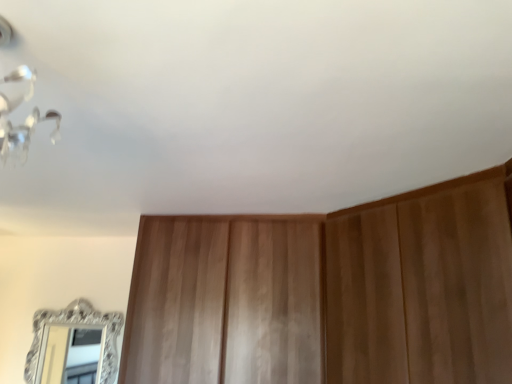
Question: Is wooden dresser at center not within silver ornate mirror at lower left?

Choices:
 (A) no
 (B) yes

Answer: (B)

Question: From a real-world perspective, is wooden dresser at center located beneath silver ornate mirror at lower left?

Choices:
 (A) yes
 (B) no

Answer: (B)

Question: Is wooden dresser at center thinner than silver ornate mirror at lower left?

Choices:
 (A) yes
 (B) no

Answer: (B)

Question: Considering the relative sizes of wooden dresser at center and silver ornate mirror at lower left in the image provided, is wooden dresser at center shorter than silver ornate mirror at lower left?

Choices:
 (A) no
 (B) yes

Answer: (A)

Question: From the image's perspective, is wooden dresser at center beneath silver ornate mirror at lower left?

Choices:
 (A) yes
 (B) no

Answer: (B)

Question: Is silver ornate mirror at lower left located within wooden dresser at center?

Choices:
 (A) no
 (B) yes

Answer: (A)

Question: From a real-world perspective, is silver ornate mirror at lower left below wooden dresser at center?

Choices:
 (A) no
 (B) yes

Answer: (B)

Question: From the image's perspective, is silver ornate mirror at lower left under wooden dresser at center?

Choices:
 (A) yes
 (B) no

Answer: (A)

Question: Does silver ornate mirror at lower left have a larger size compared to wooden dresser at center?

Choices:
 (A) no
 (B) yes

Answer: (A)

Question: Is silver ornate mirror at lower left turned away from wooden dresser at center?

Choices:
 (A) yes
 (B) no

Answer: (B)

Question: Is silver ornate mirror at lower left shorter than wooden dresser at center?

Choices:
 (A) no
 (B) yes

Answer: (B)

Question: Is silver ornate mirror at lower left aimed at wooden dresser at center?

Choices:
 (A) no
 (B) yes

Answer: (A)

Question: Considering the relative positions of silver ornate mirror at lower left and wooden dresser at center in the image provided, is silver ornate mirror at lower left to the left or to the right of wooden dresser at center?

Choices:
 (A) left
 (B) right

Answer: (A)